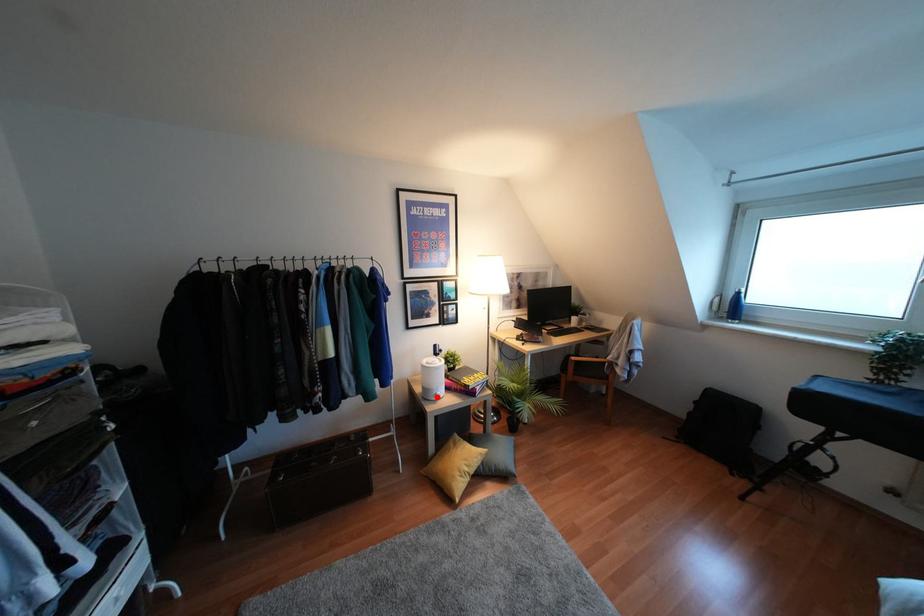
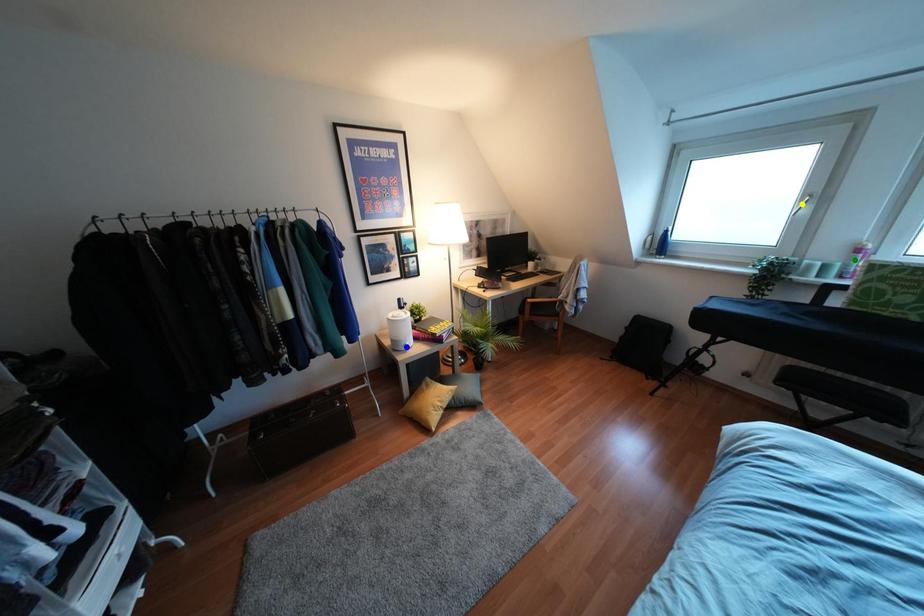
Question: I am providing you with two images of the same scene from different viewpoints. A red point is marked on the first image. You are given multiple points on the second image. In image 2, which mark is for the same physical point as the one in image 1?

Choices:
 (A) yellow point
 (B) blue point
 (C) green point

Answer: (B)